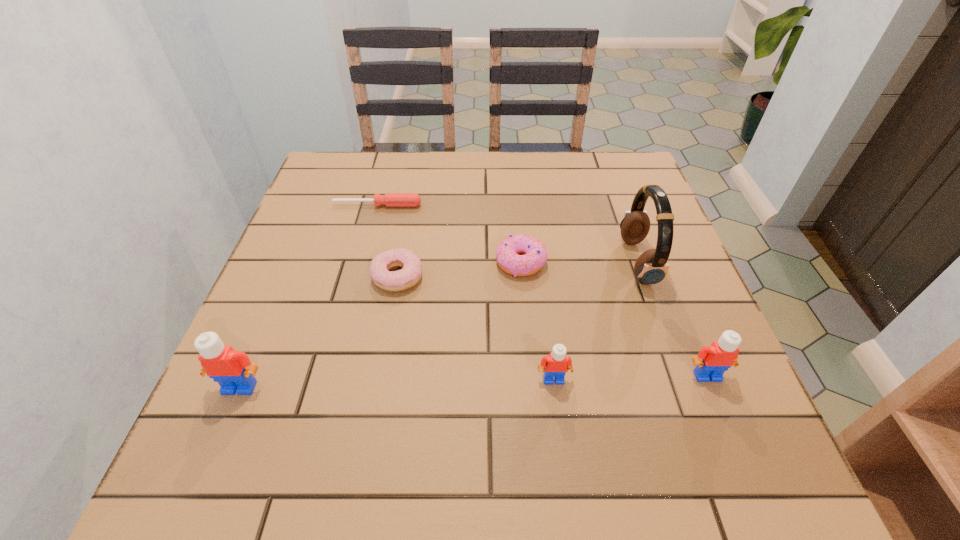
The height and width of the screenshot is (540, 960). I want to click on the leftmost Lego, so click(x=234, y=372).

Where is `the tallest Lego`? the tallest Lego is located at coordinates (234, 372).

I want to click on the shortest Lego, so click(555, 365).

The height and width of the screenshot is (540, 960). I want to click on the fourth shortest object, so click(555, 365).

This screenshot has width=960, height=540. I want to click on the fifth shortest object, so click(712, 361).

The width and height of the screenshot is (960, 540). What are the coordinates of `the rightmost Lego` in the screenshot? It's located at (712, 361).

At what (x,y) coordinates should I click in order to perform the action: click on screwdriver. Please return your answer as a coordinate pair (x, y). The height and width of the screenshot is (540, 960). Looking at the image, I should click on (389, 199).

In order to click on the shortest object in this screenshot , I will do `click(389, 199)`.

At what (x,y) coordinates should I click in order to perform the action: click on the tallest object. Please return your answer as a coordinate pair (x, y). Looking at the image, I should click on [x=651, y=267].

This screenshot has width=960, height=540. I want to click on the third shortest object, so click(535, 254).